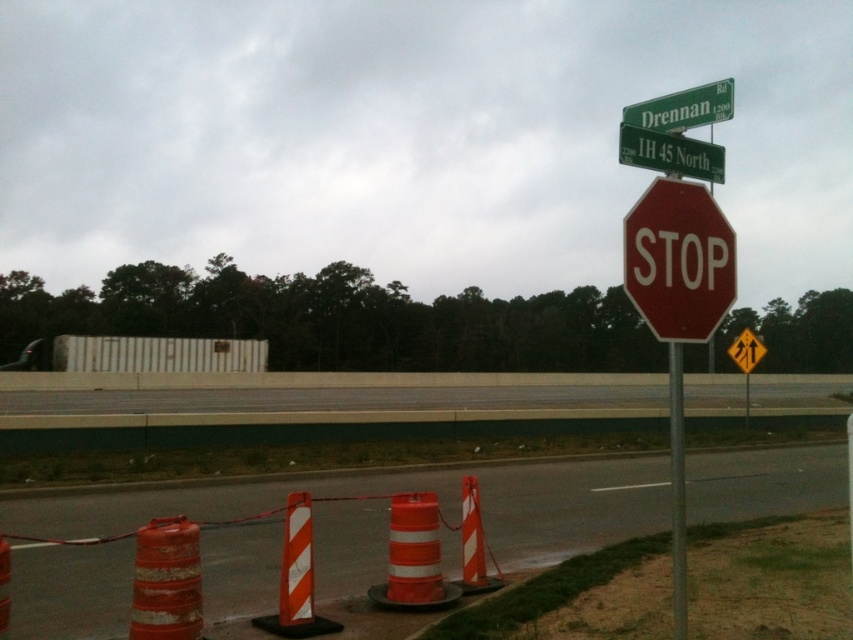
In the scene shown: You are a delivery driver approaching the stop sign and see the orange reflective cones at lower center and the orange reflective traffic cone at lower center. Which one is larger in size?

The orange reflective cones at lower center is bigger than orange reflective traffic cone at lower center.

You are a pedestrian standing at point (413, 490). You see orange reflective cones at lower center. What is located at your current position?

At point (413, 490) lies orange reflective cones at lower center.